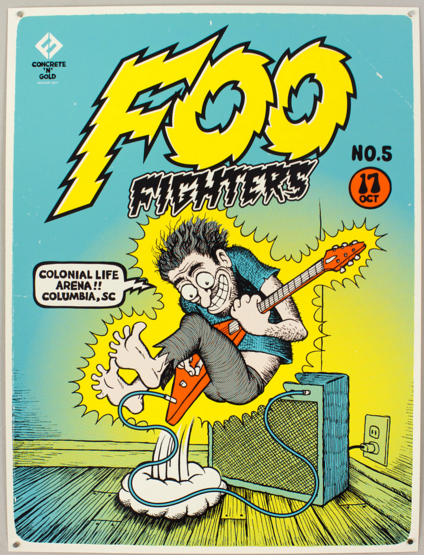
At what (x,y) coordinates should I click in order to perform the action: click on floor. Please return your answer as a coordinate pair (x, y). This screenshot has height=555, width=424. Looking at the image, I should click on (270, 526).